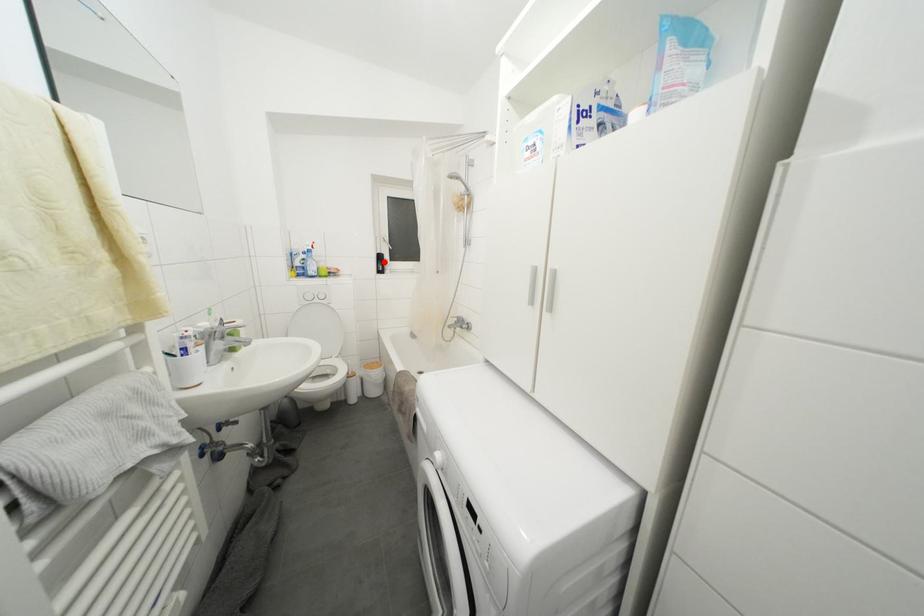
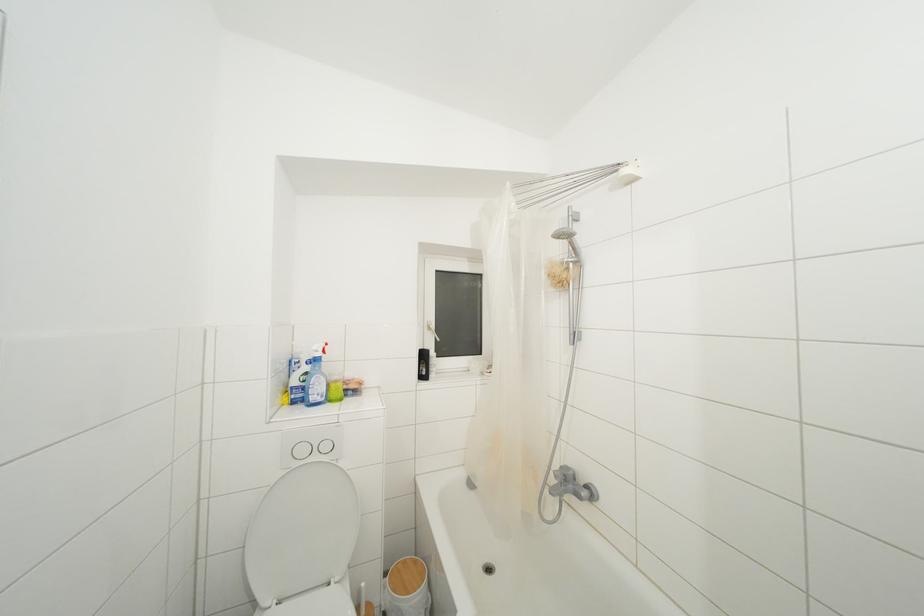
Question: I am providing you with two images of the same scene from different viewpoints. In image1, a red point is highlighted. Considering the same 3D point in image2, which of the following is correct?

Choices:
 (A) It is closer
 (B) It is farther

Answer: (B)